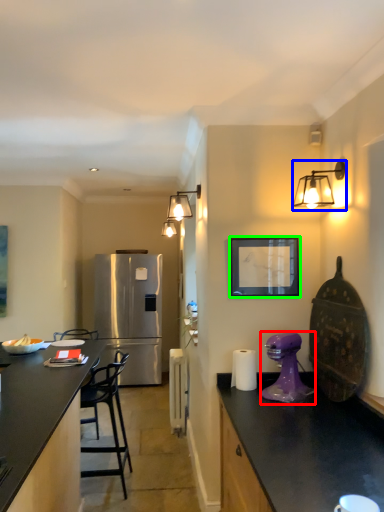
Question: Based on their relative distances, which object is nearer to kitchen appliance (highlighted by a red box)? Choose from light fixture (highlighted by a blue box) and picture frame (highlighted by a green box).

Choices:
 (A) light fixture
 (B) picture frame

Answer: (B)